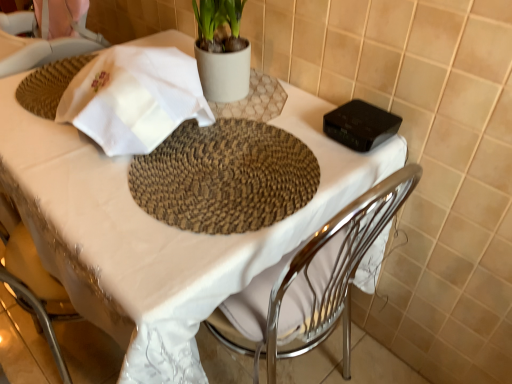
Question: Is white embroidered cloth at upper left looking in the opposite direction of white fabric table at center?

Choices:
 (A) no
 (B) yes

Answer: (A)

Question: Could you tell me if white embroidered cloth at upper left is turned towards white fabric table at center?

Choices:
 (A) no
 (B) yes

Answer: (A)

Question: Considering the relative sizes of white embroidered cloth at upper left and white fabric table at center in the image provided, is white embroidered cloth at upper left smaller than white fabric table at center?

Choices:
 (A) yes
 (B) no

Answer: (A)

Question: Does white embroidered cloth at upper left touch white fabric table at center?

Choices:
 (A) yes
 (B) no

Answer: (B)

Question: Considering the relative positions of white embroidered cloth at upper left and white fabric table at center in the image provided, is white embroidered cloth at upper left to the left of white fabric table at center from the viewer's perspective?

Choices:
 (A) no
 (B) yes

Answer: (B)

Question: From the image's perspective, is white embroidered cloth at upper left over white fabric table at center?

Choices:
 (A) yes
 (B) no

Answer: (A)

Question: Is white fabric table at center aimed at white embroidered cloth at upper left?

Choices:
 (A) no
 (B) yes

Answer: (A)

Question: Considering the relative sizes of white fabric table at center and white embroidered cloth at upper left in the image provided, is white fabric table at center smaller than white embroidered cloth at upper left?

Choices:
 (A) no
 (B) yes

Answer: (A)

Question: Is white fabric table at center positioned behind white embroidered cloth at upper left?

Choices:
 (A) yes
 (B) no

Answer: (B)

Question: Is white fabric table at center to the right of white embroidered cloth at upper left from the viewer's perspective?

Choices:
 (A) no
 (B) yes

Answer: (B)

Question: Is white fabric table at center positioned beyond the bounds of white embroidered cloth at upper left?

Choices:
 (A) no
 (B) yes

Answer: (B)

Question: Is white fabric table at center placed right next to white embroidered cloth at upper left?

Choices:
 (A) no
 (B) yes

Answer: (A)

Question: Considering the positions of white embroidered cloth at upper left and white fabric table at center in the image, is white embroidered cloth at upper left wider or thinner than white fabric table at center?

Choices:
 (A) thin
 (B) wide

Answer: (A)